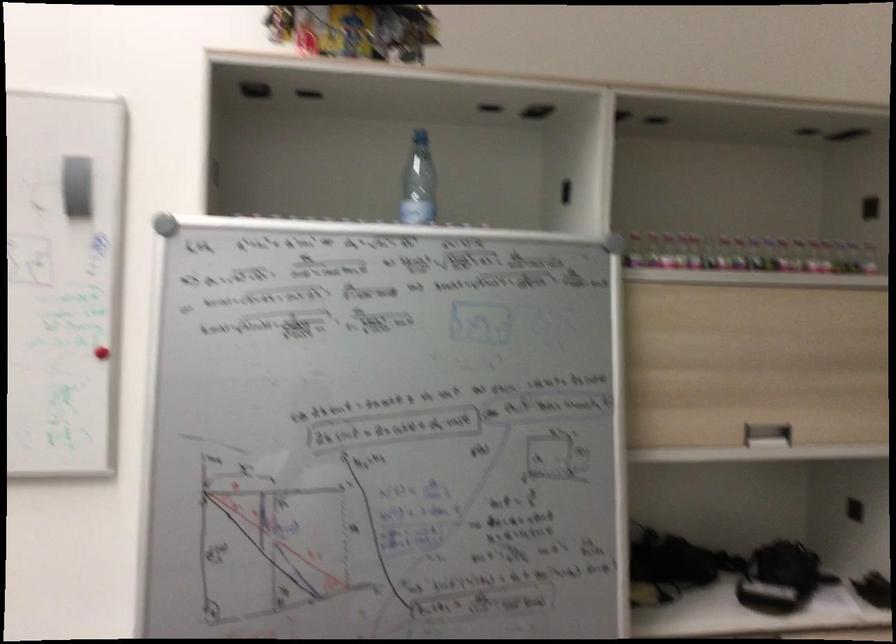
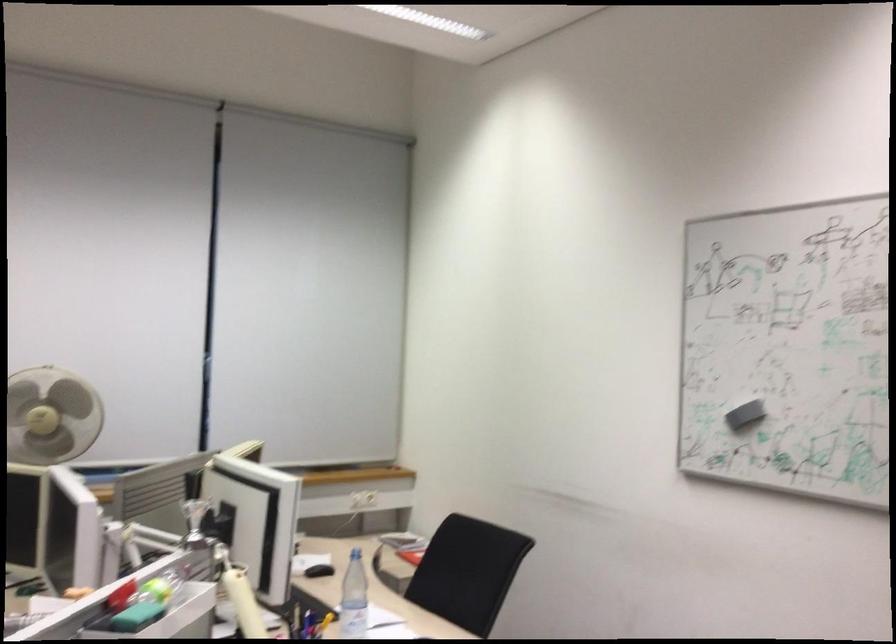
Question: The first image is from the beginning of the video and the second image is from the end. How did the camera likely rotate when shooting the video?

Choices:
 (A) Left
 (B) Right
 (C) Up
 (D) Down

Answer: (A)